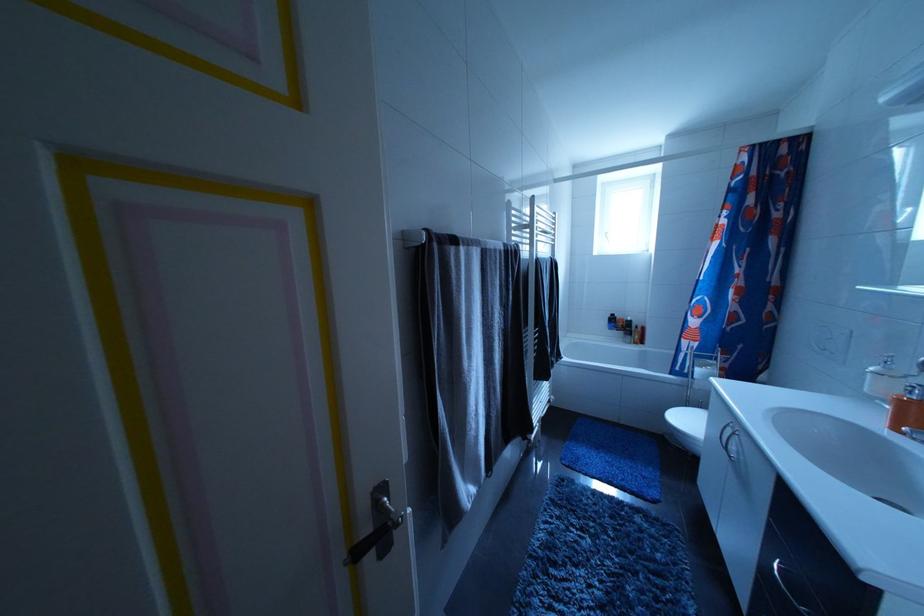
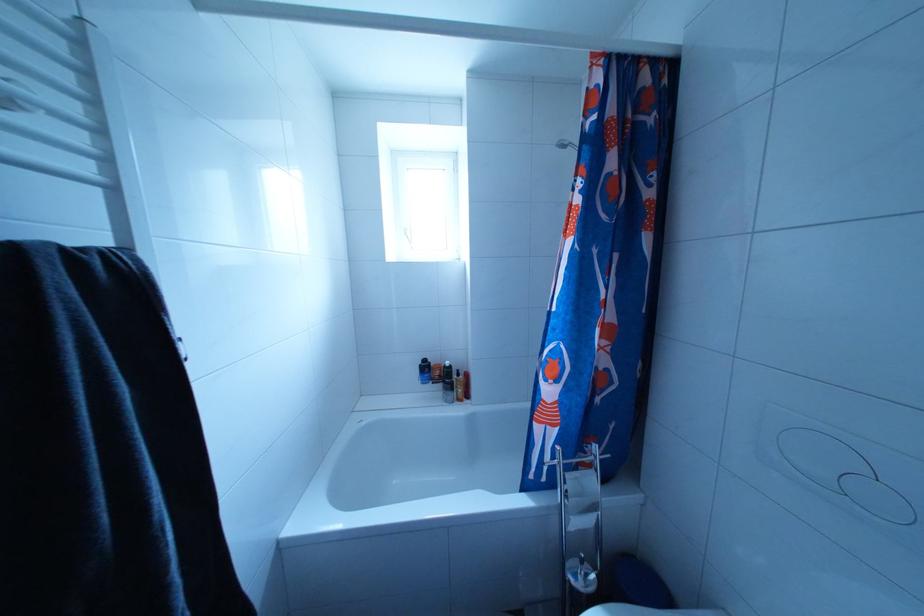
Find the pixel in the second image that matches (635,339) in the first image.

(455, 395)